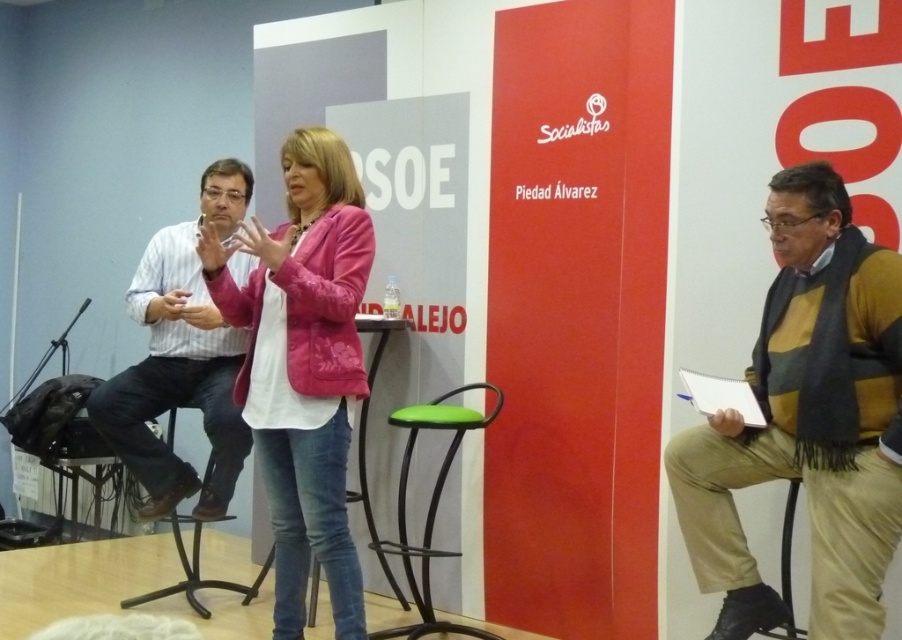
Can you confirm if green fabric stool at center is smaller than metallic silver chair at lower right?

Incorrect, green fabric stool at center is not smaller in size than metallic silver chair at lower right.

Who is more forward, [454,449] or [787,580]?

Positioned in front is point [787,580].

Does point (424, 554) come closer to viewer compared to point (787, 497)?

No, it is not.

Where is `green fabric stool at center`? green fabric stool at center is located at coordinates (430, 504).

Image resolution: width=902 pixels, height=640 pixels. Identify the location of striped wool sweater at right. (807, 420).

Does striped wool sweater at right have a greater width compared to striped cotton shirt at left?

No.

Measure the distance between striped wool sweater at right and camera.

striped wool sweater at right and camera are 2.31 meters apart.

Image resolution: width=902 pixels, height=640 pixels. I want to click on striped wool sweater at right, so click(x=807, y=420).

Which is more to the left, striped cotton shirt at left or green fabric stool at center?

From the viewer's perspective, striped cotton shirt at left appears more on the left side.

Can you confirm if striped cotton shirt at left is positioned to the left of green fabric stool at center?

Correct, you'll find striped cotton shirt at left to the left of green fabric stool at center.

Does point (210, 317) come farther from viewer compared to point (481, 637)?

No.

Where is `striped cotton shirt at left`? striped cotton shirt at left is located at coordinates (175, 380).